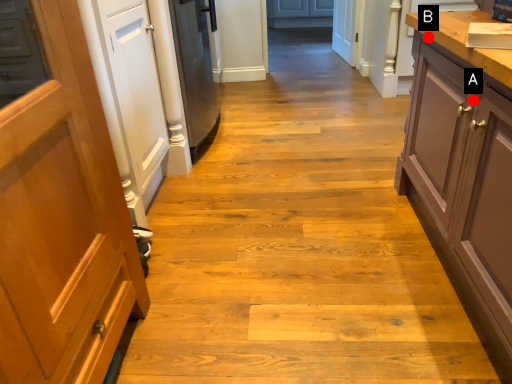
Question: Two points are circled on the image, labeled by A and B beside each circle. Among these points, which one is nearest to the camera?

Choices:
 (A) A is closer
 (B) B is closer

Answer: (A)